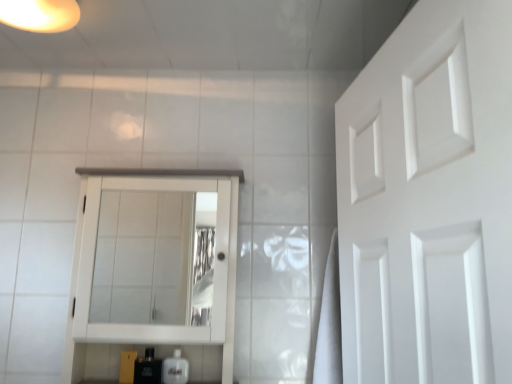
At what (x,y) coordinates should I click in order to perform the action: click on translucent plastic soap at lower center, the 1th toiletry positioned from the right. Please return your answer as a coordinate pair (x, y). Looking at the image, I should click on (175, 369).

The image size is (512, 384). I want to click on white matte door at right, so click(x=429, y=201).

Does matte yellow light fixture at upper left have a greater height compared to white wood medicine cabinet at center?

Incorrect, the height of matte yellow light fixture at upper left is not larger of that of white wood medicine cabinet at center.

Is matte yellow light fixture at upper left not inside white wood medicine cabinet at center?

Indeed, matte yellow light fixture at upper left is completely outside white wood medicine cabinet at center.

Is point (42, 17) closer to viewer compared to point (74, 283)?

That is True.

Between white wood medicine cabinet at center and translucent plastic soap at lower center, the 2th toiletry viewed from the left, which one is positioned behind?

translucent plastic soap at lower center, the 2th toiletry viewed from the left, is behind.

Does white wood medicine cabinet at center have a smaller size compared to translucent plastic soap at lower center, the 2th toiletry viewed from the left?

Actually, white wood medicine cabinet at center might be larger than translucent plastic soap at lower center, the 2th toiletry viewed from the left.

From the image's perspective, between white wood medicine cabinet at center and translucent plastic soap at lower center, the 1th toiletry positioned from the right, which one is located above?

From the image's view, white wood medicine cabinet at center is above.

Is white wood medicine cabinet at center looking in the opposite direction of translucent plastic soap at lower center, the 2th toiletry viewed from the left?

Yes, white wood medicine cabinet at center is facing away from translucent plastic soap at lower center, the 2th toiletry viewed from the left.

Between point (188, 369) and point (155, 379), which one is positioned in front?

The point (155, 379) is closer to the camera.

From the image's perspective, is translucent plastic soap at lower center, the 1th toiletry positioned from the right, positioned above or below black glossy bottle at lower left, positioned as the 1th toiletry in left-to-right order?

translucent plastic soap at lower center, the 1th toiletry positioned from the right, is situated lower than black glossy bottle at lower left, positioned as the 1th toiletry in left-to-right order, in the image.

Looking at this image, is translucent plastic soap at lower center, the 1th toiletry positioned from the right, aimed at black glossy bottle at lower left, positioned as the 1th toiletry in left-to-right order?

No, translucent plastic soap at lower center, the 1th toiletry positioned from the right, does not turn towards black glossy bottle at lower left, positioned as the 1th toiletry in left-to-right order.

Measure the distance from translucent plastic soap at lower center, the 2th toiletry viewed from the left, to black glossy bottle at lower left, positioned as the 1th toiletry in left-to-right order.

translucent plastic soap at lower center, the 2th toiletry viewed from the left, is 5.23 centimeters from black glossy bottle at lower left, positioned as the 1th toiletry in left-to-right order.

Consider the image. Could you tell me if white wood medicine cabinet at center is turned towards black glossy bottle at lower left, positioned as the 1th toiletry in left-to-right order?

Yes, white wood medicine cabinet at center is oriented towards black glossy bottle at lower left, positioned as the 1th toiletry in left-to-right order.

Considering the points (226, 245) and (148, 349), which point is in front, point (226, 245) or point (148, 349)?

Point (226, 245)

Which of these two, white wood medicine cabinet at center or black glossy bottle at lower left, which ranks as the second toiletry in right-to-left order, is bigger?

Bigger between the two is white wood medicine cabinet at center.

Where is `medicine cabinet that is in front of the black glossy bottle at lower left, which ranks as the second toiletry in right-to-left order`? medicine cabinet that is in front of the black glossy bottle at lower left, which ranks as the second toiletry in right-to-left order is located at coordinates (94, 264).

Is black glossy bottle at lower left, which ranks as the second toiletry in right-to-left order, closer to the viewer compared to white wood medicine cabinet at center?

No, black glossy bottle at lower left, which ranks as the second toiletry in right-to-left order, is further to the viewer.

Looking at this image, would you say black glossy bottle at lower left, which ranks as the second toiletry in right-to-left order, is to the left or to the right of white wood medicine cabinet at center in the picture?

From the image, it's evident that black glossy bottle at lower left, which ranks as the second toiletry in right-to-left order, is to the left of white wood medicine cabinet at center.

Does point (39, 17) come closer to viewer compared to point (146, 361)?

Yes, point (39, 17) is in front of point (146, 361).

From the image's perspective, which is below, matte yellow light fixture at upper left or black glossy bottle at lower left, which ranks as the second toiletry in right-to-left order?

black glossy bottle at lower left, which ranks as the second toiletry in right-to-left order, from the image's perspective.

Looking at this image, which object is closer to the camera, matte yellow light fixture at upper left or black glossy bottle at lower left, positioned as the 1th toiletry in left-to-right order?

matte yellow light fixture at upper left is closer to the camera.

How much distance is there between matte yellow light fixture at upper left and black glossy bottle at lower left, positioned as the 1th toiletry in left-to-right order?

matte yellow light fixture at upper left is 3.68 feet away from black glossy bottle at lower left, positioned as the 1th toiletry in left-to-right order.

I want to click on door on the right of matte yellow light fixture at upper left, so click(429, 201).

Considering the relative sizes of matte yellow light fixture at upper left and white matte door at right in the image provided, is matte yellow light fixture at upper left wider than white matte door at right?

Correct, the width of matte yellow light fixture at upper left exceeds that of white matte door at right.

Can you confirm if matte yellow light fixture at upper left is shorter than white matte door at right?

Correct, matte yellow light fixture at upper left is not as tall as white matte door at right.

Is white matte door at right at the back of matte yellow light fixture at upper left?

No, matte yellow light fixture at upper left's orientation is not away from white matte door at right.

You are a GUI agent. You are given a task and a screenshot of the screen. Output one action in this format:
    pyautogui.click(x=<x>, y=<y>)
    Task: Click on the light fixture lying in front of the white wood medicine cabinet at center
    
    Given the screenshot: What is the action you would take?
    pyautogui.click(x=40, y=15)

Starting from the white wood medicine cabinet at center, which toiletry is the 2nd one behind? Please provide its 2D coordinates.

[(175, 369)]

Considering their positions, is white wood medicine cabinet at center positioned further to white matte door at right than black glossy bottle at lower left, positioned as the 1th toiletry in left-to-right order?

Based on the image, black glossy bottle at lower left, positioned as the 1th toiletry in left-to-right order, appears to be further to white matte door at right.

Based on their spatial positions, is matte yellow light fixture at upper left or white matte door at right further from translucent plastic soap at lower center, the 2th toiletry viewed from the left?

Based on the image, matte yellow light fixture at upper left appears to be further to translucent plastic soap at lower center, the 2th toiletry viewed from the left.

When comparing their distances from matte yellow light fixture at upper left, does white wood medicine cabinet at center or translucent plastic soap at lower center, the 1th toiletry positioned from the right, seem closer?

white wood medicine cabinet at center.

Based on their spatial positions, is translucent plastic soap at lower center, the 1th toiletry positioned from the right, or black glossy bottle at lower left, positioned as the 1th toiletry in left-to-right order, further from white matte door at right?

black glossy bottle at lower left, positioned as the 1th toiletry in left-to-right order, lies further to white matte door at right than the other object.

From the picture: Estimate the real-world distances between objects in this image. Which object is further from black glossy bottle at lower left, which ranks as the second toiletry in right-to-left order, translucent plastic soap at lower center, the 2th toiletry viewed from the left, or white wood medicine cabinet at center?

white wood medicine cabinet at center lies further to black glossy bottle at lower left, which ranks as the second toiletry in right-to-left order, than the other object.

Estimate the real-world distances between objects in this image. Which object is further from black glossy bottle at lower left, which ranks as the second toiletry in right-to-left order, white matte door at right or white wood medicine cabinet at center?

Among the two, white matte door at right is located further to black glossy bottle at lower left, which ranks as the second toiletry in right-to-left order.

From the image, which object appears to be nearer to white matte door at right, white wood medicine cabinet at center or translucent plastic soap at lower center, the 1th toiletry positioned from the right?

Among the two, white wood medicine cabinet at center is located nearer to white matte door at right.

Estimate the real-world distances between objects in this image. Which object is closer to white wood medicine cabinet at center, matte yellow light fixture at upper left or black glossy bottle at lower left, positioned as the 1th toiletry in left-to-right order?

black glossy bottle at lower left, positioned as the 1th toiletry in left-to-right order, is closer to white wood medicine cabinet at center.

Locate an element on the screen. Image resolution: width=512 pixels, height=384 pixels. medicine cabinet located between white matte door at right and black glossy bottle at lower left, which ranks as the second toiletry in right-to-left order, in the depth direction is located at coordinates (94, 264).

Where is `door between matte yellow light fixture at upper left and translucent plastic soap at lower center, the 2th toiletry viewed from the left, in the up-down direction`? The width and height of the screenshot is (512, 384). door between matte yellow light fixture at upper left and translucent plastic soap at lower center, the 2th toiletry viewed from the left, in the up-down direction is located at coordinates (429, 201).

Identify the location of toiletry between white wood medicine cabinet at center and translucent plastic soap at lower center, the 2th toiletry viewed from the left, in the vertical direction. This screenshot has width=512, height=384. (148, 368).

Where is `medicine cabinet between matte yellow light fixture at upper left and white matte door at right in the horizontal direction`? Image resolution: width=512 pixels, height=384 pixels. medicine cabinet between matte yellow light fixture at upper left and white matte door at right in the horizontal direction is located at coordinates tap(94, 264).